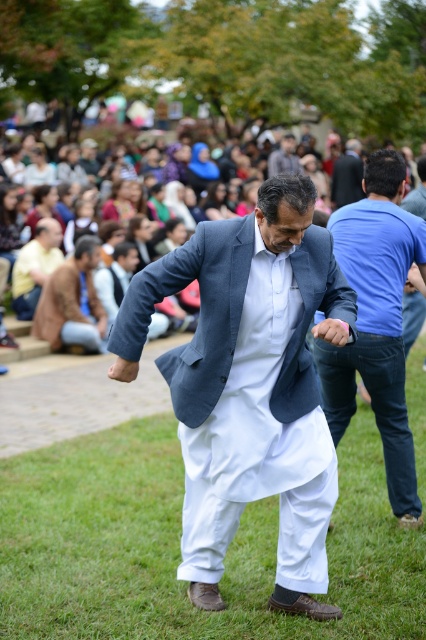
Question: Estimate the real-world distances between objects in this image. Which object is closer to the light brown leather jacket at lower left?

Choices:
 (A) dark gray suit at upper center
 (B) brown leather jacket at left
 (C) matte blue suit at center
 (D) dark blue suit at center

Answer: (B)

Question: Which of the following is the farthest from the observer?

Choices:
 (A) dark blue suit at center
 (B) blue cotton shirt at center
 (C) light brown leather jacket at lower left

Answer: (A)

Question: Is brown leather jacket at left to the left of matte white crowd at center from the viewer's perspective?

Choices:
 (A) no
 (B) yes

Answer: (B)

Question: Which point appears farthest from the camera in this image?

Choices:
 (A) (77, 276)
 (B) (65, 605)

Answer: (A)

Question: Can you confirm if green grass at center is positioned to the right of dark blue suit at center?

Choices:
 (A) yes
 (B) no

Answer: (B)

Question: In this image, where is green grass at center located relative to blue cotton shirt at center?

Choices:
 (A) above
 (B) below

Answer: (B)